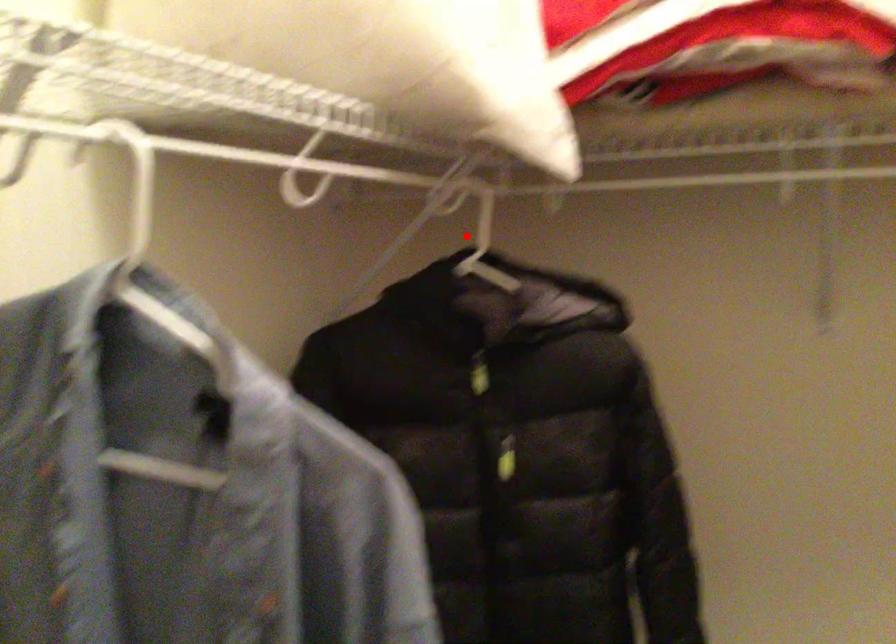
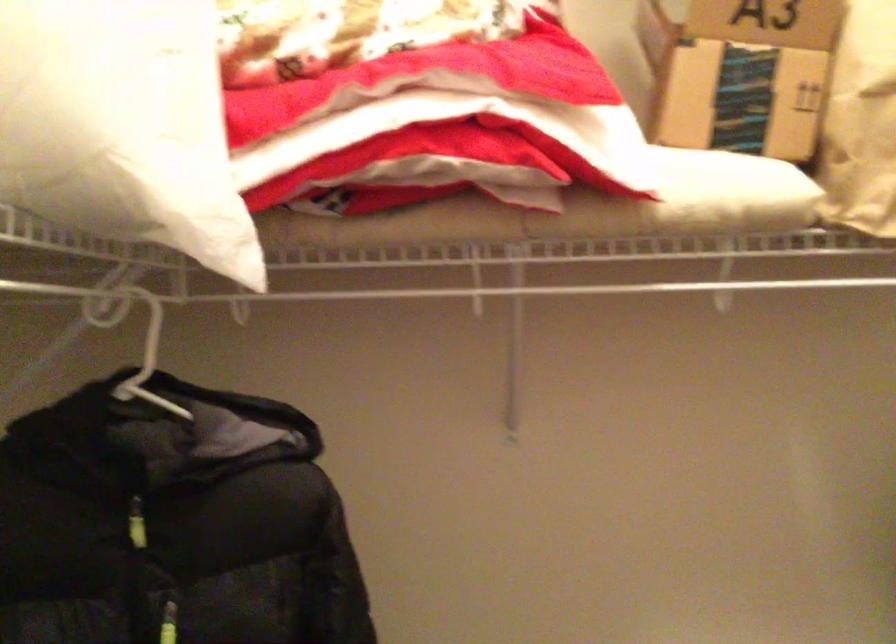
Question: I am providing you with two images of the same scene from different viewpoints. Given a red point in image1, look at the same physical point in image2. Is it:

Choices:
 (A) Closer to the viewpoint
 (B) Farther from the viewpoint

Answer: (A)